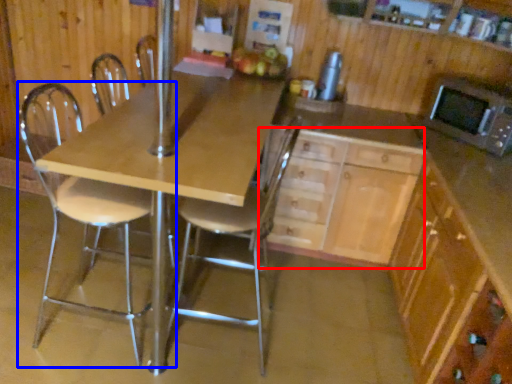
Question: Which point is closer to the camera, cabinetry (highlighted by a red box) or chair (highlighted by a blue box)?

Choices:
 (A) cabinetry
 (B) chair

Answer: (B)